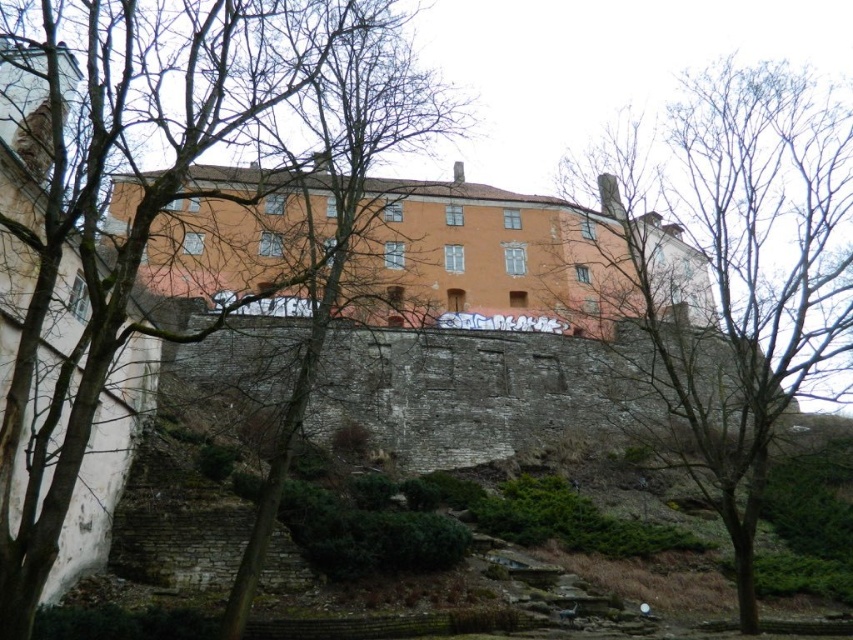
You are an arborist assessing the health of the trees in the image. Which set of branches has a wider spread, the bare branches at center or the bare branches at upper center?

The bare branches at center have a wider spread than the bare branches at upper center.